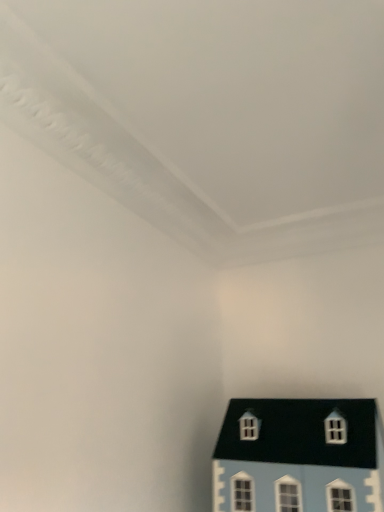
Locate an element on the screen. Image resolution: width=384 pixels, height=512 pixels. white matte house at lower right is located at coordinates (299, 456).

What do you see at coordinates (299, 456) in the screenshot?
I see `white matte house at lower right` at bounding box center [299, 456].

The width and height of the screenshot is (384, 512). I want to click on white matte house at lower right, so click(x=299, y=456).